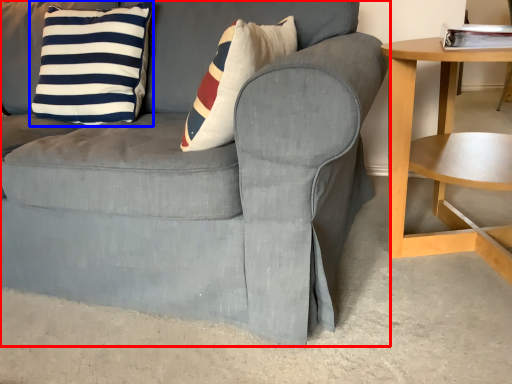
Question: Which object appears closest to the camera in this image, chair (highlighted by a red box) or pillow (highlighted by a blue box)?

Choices:
 (A) chair
 (B) pillow

Answer: (A)